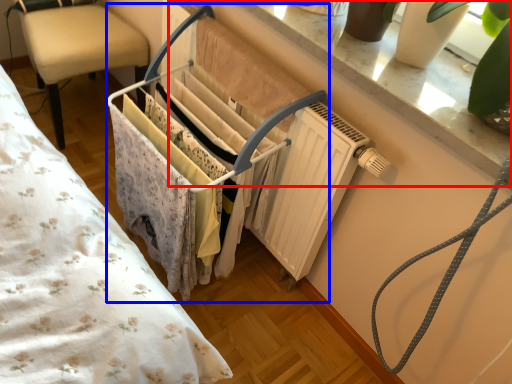
Question: Which object appears farthest to the camera in this image, window sill (highlighted by a red box) or closet (highlighted by a blue box)?

Choices:
 (A) window sill
 (B) closet

Answer: (B)